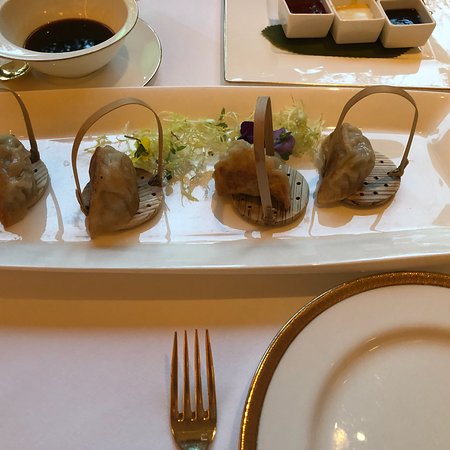
You are a GUI agent. You are given a task and a screenshot of the screen. Output one action in this format:
    pyautogui.click(x=<x>, y=<y>)
    Task: Click on the spoon
    
    Given the screenshot: What is the action you would take?
    pyautogui.click(x=14, y=73)